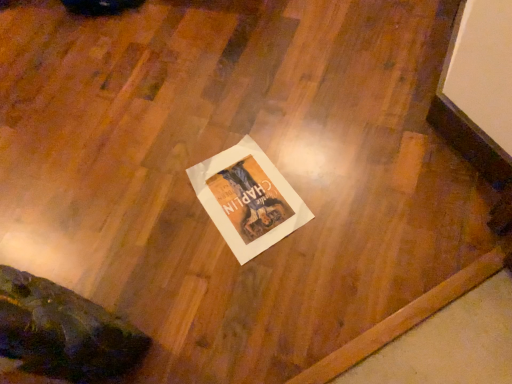
Locate an element on the screen. The width and height of the screenshot is (512, 384). vacant area on the back side of white paper poster at center is located at coordinates (267, 113).